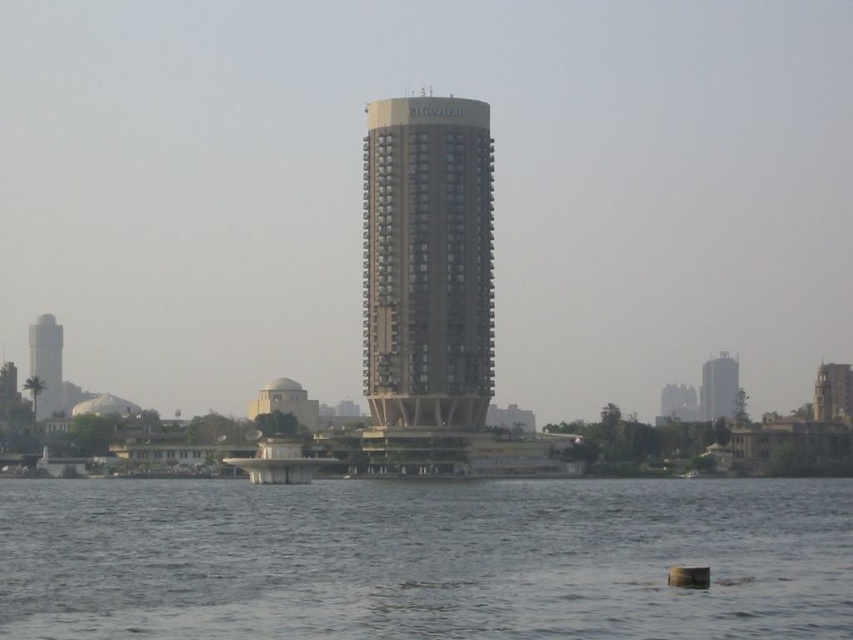
You are a photographer planning to capture the gold metallic tower at center and the matte white tower at left in a single frame. Based on their positions, which tower should you focus on first to ensure both are in the frame?

The gold metallic tower at center is positioned on the right side of matte white tower at left, so you should focus on the matte white tower at left first to ensure both are included in the frame.

You are a tourist standing on the dock near the river. You see the gold metallic tower at center and the matte white tower at left. Which tower can you see the top of first as you look upward?

The gold metallic tower at center is taller than the matte white tower at left, so you will see the top of the gold metallic tower at center first when looking upward.

You are a drone operator who needs to fly a drone from your current position to the gold metallic tower at center. The drone has a maximum flight range of 600 meters. Can the drone reach the tower?

The gold metallic tower at center is 605.25 meters from camera. Since the drone can only fly up to 600 meters, it cannot reach the tower.